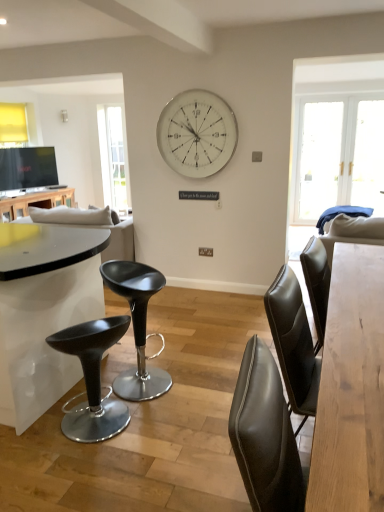
Question: Is white glossy table at left, marked as the second table in a bottom-to-top arrangement, touching matte black stool at center?

Choices:
 (A) no
 (B) yes

Answer: (A)

Question: Is white glossy table at left, the first table viewed from the top, oriented towards matte black stool at center?

Choices:
 (A) no
 (B) yes

Answer: (A)

Question: Is white glossy table at left, which ranks as the second table in front-to-back order, bigger than matte black stool at center?

Choices:
 (A) yes
 (B) no

Answer: (A)

Question: Can you confirm if white glossy table at left, marked as the second table in a bottom-to-top arrangement, is thinner than matte black stool at center?

Choices:
 (A) yes
 (B) no

Answer: (B)

Question: Can you confirm if white glossy table at left, the first table viewed from the top, is positioned to the left of matte black stool at center?

Choices:
 (A) no
 (B) yes

Answer: (B)

Question: Considering the relative positions of white glossy table at left, the first table viewed from the top, and matte black stool at center in the image provided, is white glossy table at left, the first table viewed from the top, behind matte black stool at center?

Choices:
 (A) no
 (B) yes

Answer: (B)

Question: Is the surface of clear glass window at left in direct contact with light brown wooden table at center, which ranks as the 1th table in front-to-back order?

Choices:
 (A) yes
 (B) no

Answer: (B)

Question: Does clear glass window at left have a lesser width compared to light brown wooden table at center, which is the first table from right to left?

Choices:
 (A) yes
 (B) no

Answer: (A)

Question: Could you tell me if clear glass window at left is facing light brown wooden table at center, which ranks as the 1th table in front-to-back order?

Choices:
 (A) no
 (B) yes

Answer: (A)

Question: Is clear glass window at left smaller than light brown wooden table at center, which ranks as the 1th table in front-to-back order?

Choices:
 (A) no
 (B) yes

Answer: (B)

Question: Is light brown wooden table at center, which is the first table from right to left, completely or partially inside clear glass window at left?

Choices:
 (A) no
 (B) yes

Answer: (A)

Question: Does clear glass window at left have a larger size compared to light brown wooden table at center, which is the first table from right to left?

Choices:
 (A) no
 (B) yes

Answer: (A)

Question: Does matte black stool at center have a greater width compared to white glossy table at left, the first table viewed from the top?

Choices:
 (A) no
 (B) yes

Answer: (A)